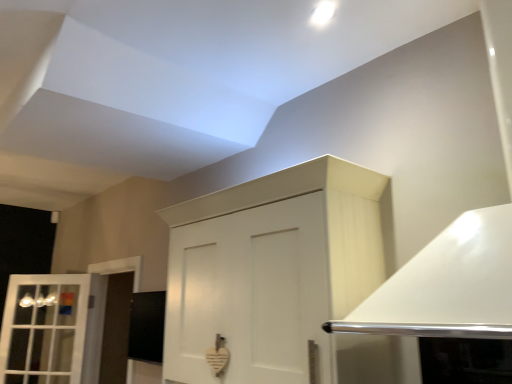
Question: From a real-world perspective, is white matte cabinet at center above or below white glass window at left?

Choices:
 (A) above
 (B) below

Answer: (A)

Question: From the image's perspective, is white matte cabinet at center positioned above or below white glass window at left?

Choices:
 (A) below
 (B) above

Answer: (B)

Question: In terms of height, does white matte cabinet at center look taller or shorter compared to white glass window at left?

Choices:
 (A) tall
 (B) short

Answer: (B)

Question: Considering the relative positions of white glass window at left and white matte cabinet at center in the image provided, is white glass window at left to the left or to the right of white matte cabinet at center?

Choices:
 (A) left
 (B) right

Answer: (A)

Question: From a real-world perspective, is white glass window at left above or below white matte cabinet at center?

Choices:
 (A) above
 (B) below

Answer: (B)

Question: Based on their sizes in the image, would you say white glass window at left is bigger or smaller than white matte cabinet at center?

Choices:
 (A) small
 (B) big

Answer: (A)

Question: Would you say white glass window at left is inside or outside white matte cabinet at center?

Choices:
 (A) outside
 (B) inside

Answer: (A)